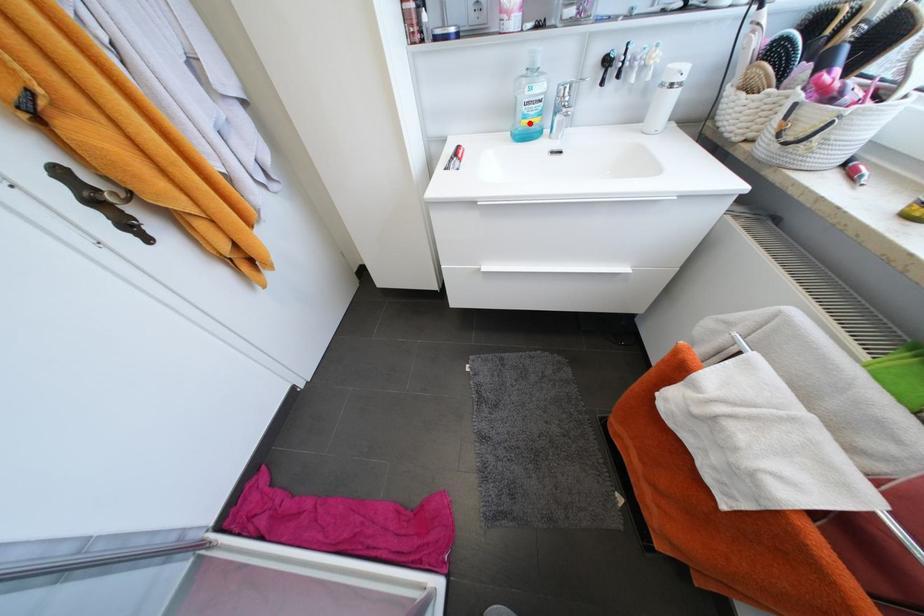
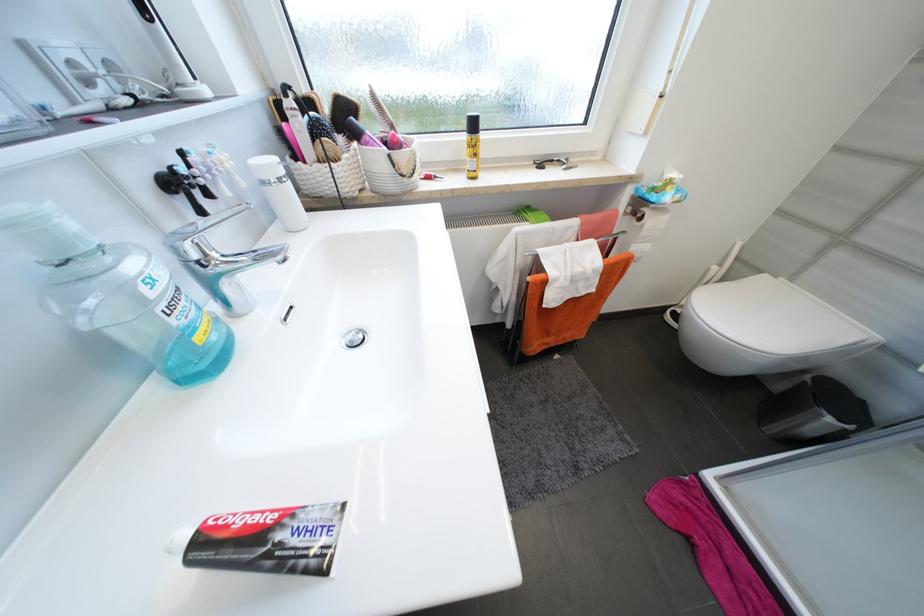
Find the pixel in the second image that matches the highlighted location in the first image.

(203, 339)